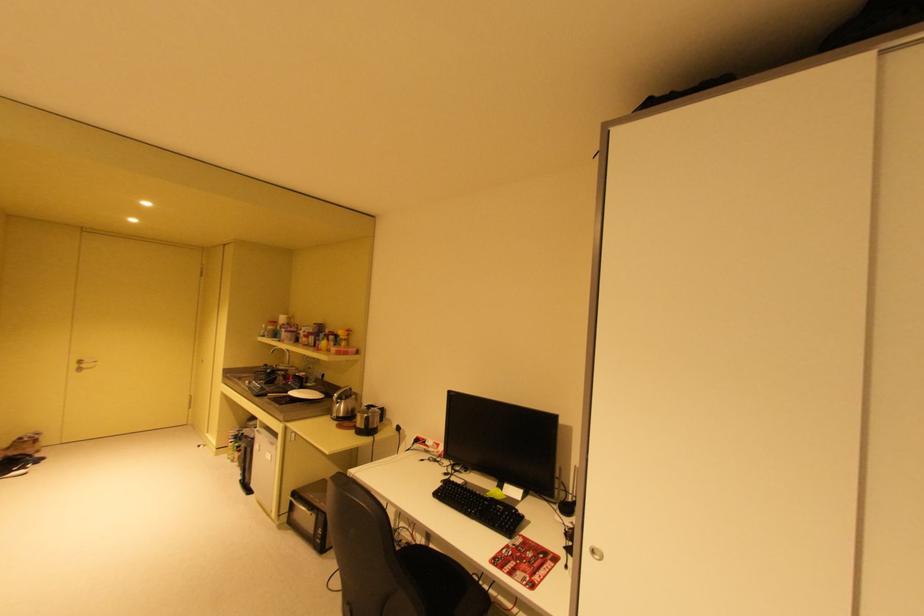
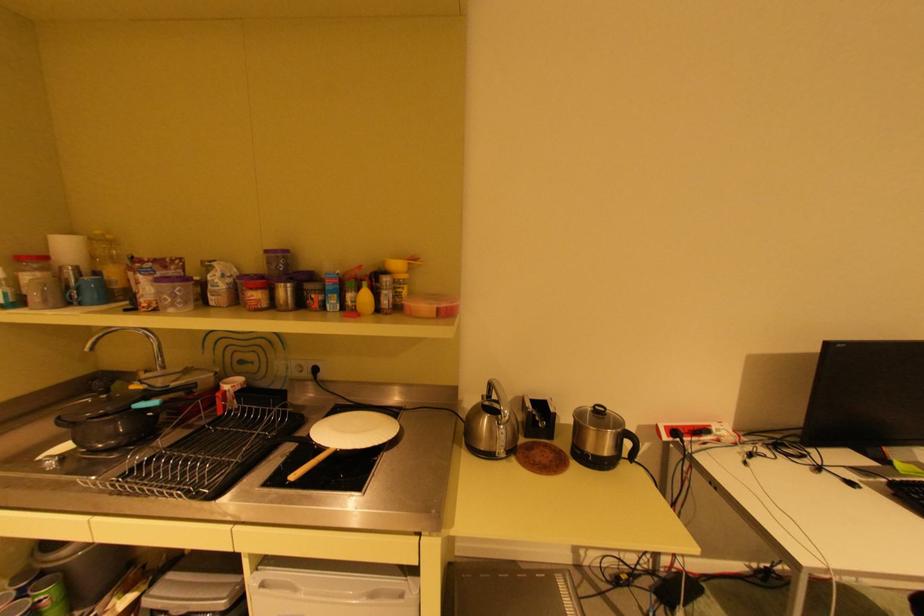
Locate, in the second image, the point that corresponds to [312,339] in the first image.

(264, 294)